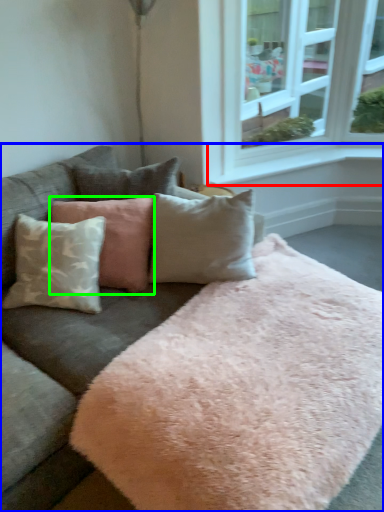
Question: Which is farther away from window sill (highlighted by a red box)? studio couch (highlighted by a blue box) or pillow (highlighted by a green box)?

Choices:
 (A) studio couch
 (B) pillow

Answer: (A)